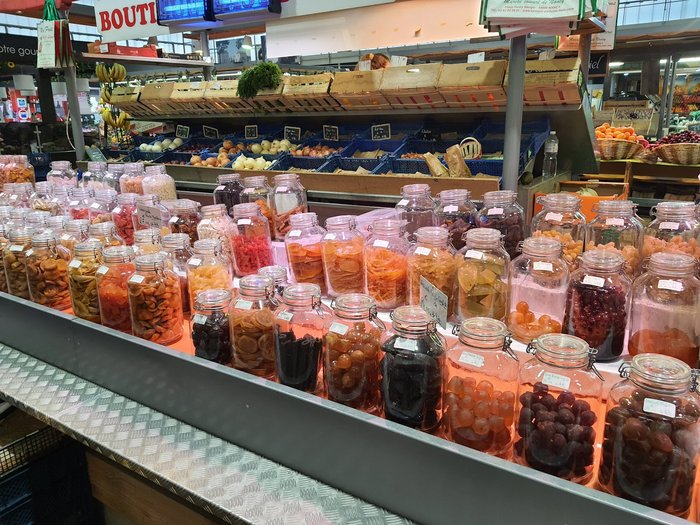
Locate an element on the screen. freezer is located at coordinates (680, 84), (644, 81).